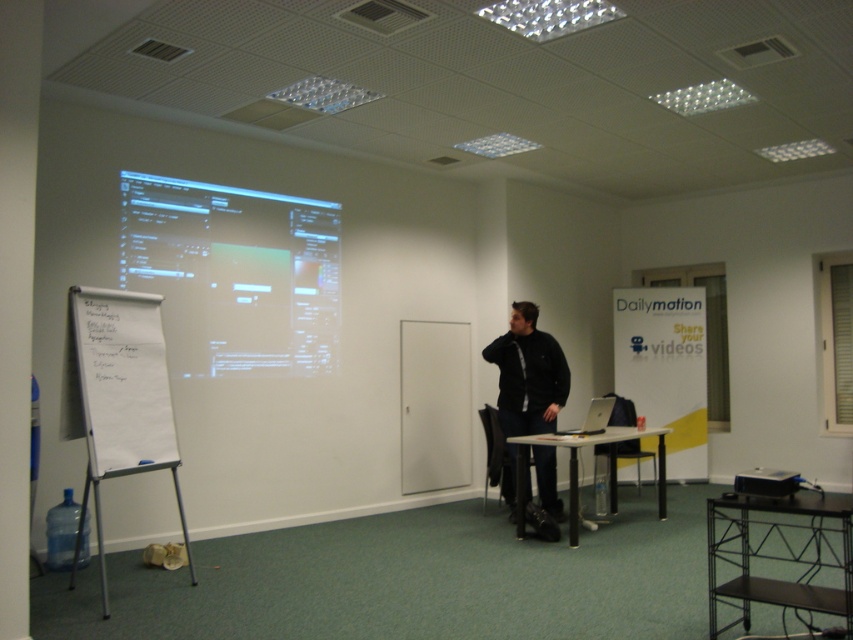
Between point (515, 352) and point (587, 436), which one is positioned in front?

Positioned in front is point (587, 436).

Can you confirm if black matte jacket at center is positioned to the left of black plastic table at center?

Correct, you'll find black matte jacket at center to the left of black plastic table at center.

Does point (527, 355) come behind point (572, 483)?

Yes, point (527, 355) is behind point (572, 483).

This screenshot has width=853, height=640. What are the coordinates of `black matte jacket at center` in the screenshot? It's located at (527, 374).

Between point (138, 220) and point (564, 433), which one is positioned behind?

Positioned behind is point (564, 433).

Does matte white projection screen at upper left have a larger size compared to silver metallic laptop at center?

Indeed, matte white projection screen at upper left has a larger size compared to silver metallic laptop at center.

In order to click on matte white projection screen at upper left in this screenshot , I will do click(234, 275).

Does white paperboard at left appear under black plastic projector at lower right?

No, white paperboard at left is not below black plastic projector at lower right.

What do you see at coordinates (120, 396) in the screenshot?
I see `white paperboard at left` at bounding box center [120, 396].

Which is behind, point (180, 497) or point (779, 477)?

The point (180, 497) is more distant.

Find the location of a particular element. The width and height of the screenshot is (853, 640). white paperboard at left is located at coordinates (120, 396).